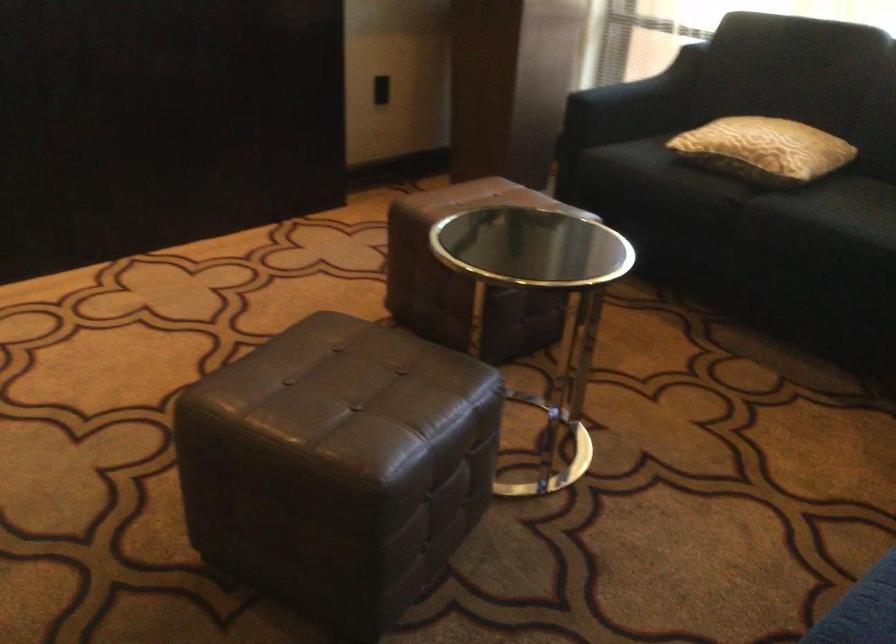
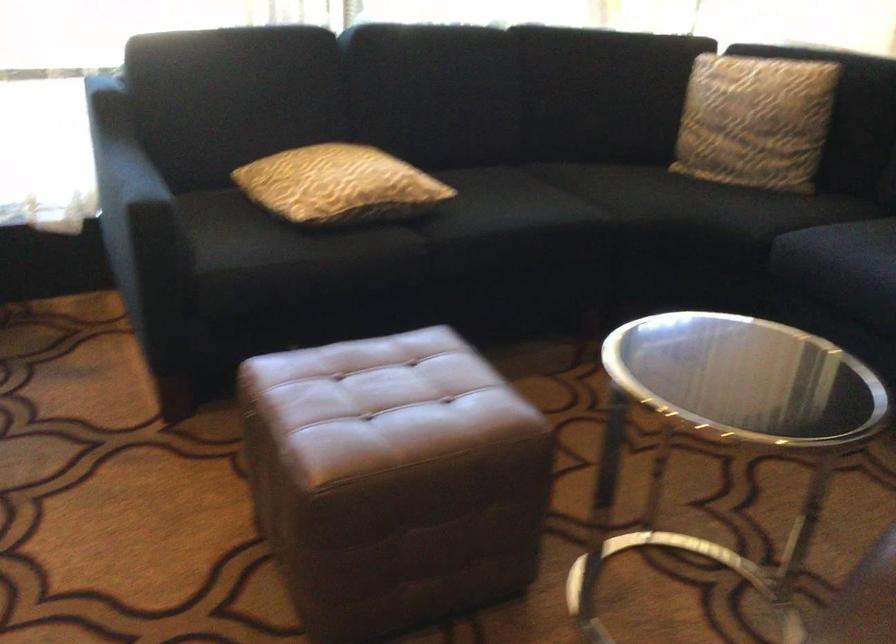
Find the pixel in the second image that matches point (780, 198) in the first image.

(426, 227)